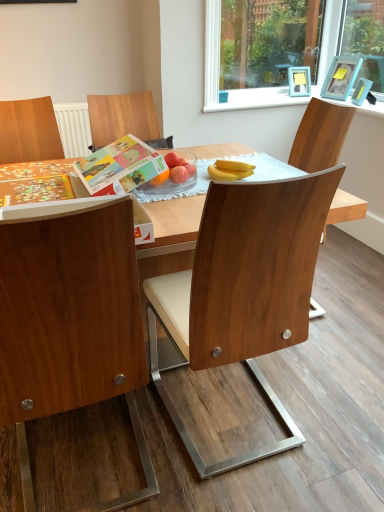
Where is `wooden chair at left, marked as the first chair in a left-to-right arrangement`? wooden chair at left, marked as the first chair in a left-to-right arrangement is located at coordinates (71, 325).

I want to click on matte paper book at center, so click(x=119, y=167).

The image size is (384, 512). What are the coordinates of `white plastic window frame at upper right` in the screenshot? It's located at (220, 73).

Describe the element at coordinates (341, 77) in the screenshot. This screenshot has height=512, width=384. I see `blue plastic picture frame at upper right, which is the 1th picture frame from top to bottom` at that location.

Identify the location of blue plastic picture frame at upper right, arranged as the first picture frame when ordered from the bottom. (361, 91).

This screenshot has width=384, height=512. I want to click on wooden chair at left, marked as the first chair in a left-to-right arrangement, so click(x=71, y=325).

From the image's perspective, which one is positioned higher, wooden chair at left, placed as the 2th chair when sorted from right to left, or wooden chair at center, the 2th chair when ordered from left to right?

wooden chair at center, the 2th chair when ordered from left to right, appears higher in the image.

Is wooden chair at left, placed as the 2th chair when sorted from right to left, not close to wooden chair at center, the 1th chair positioned from the right?

No, wooden chair at left, placed as the 2th chair when sorted from right to left, is in close proximity to wooden chair at center, the 1th chair positioned from the right.

Between wooden chair at left, marked as the first chair in a left-to-right arrangement, and wooden chair at center, the 1th chair positioned from the right, which one has larger width?

wooden chair at left, marked as the first chair in a left-to-right arrangement, is wider.

Is wooden chair at left, placed as the 2th chair when sorted from right to left, at the left side of wooden chair at center, the 2th chair when ordered from left to right?

Correct, you'll find wooden chair at left, placed as the 2th chair when sorted from right to left, to the left of wooden chair at center, the 2th chair when ordered from left to right.

Locate an element on the screen. This screenshot has height=512, width=384. book lying above the wooden chair at left, marked as the first chair in a left-to-right arrangement (from the image's perspective) is located at coordinates (119, 167).

Does wooden chair at left, placed as the 2th chair when sorted from right to left, have a larger size compared to matte paper book at center?

Yes.

Who is taller, wooden chair at left, placed as the 2th chair when sorted from right to left, or matte paper book at center?

wooden chair at left, placed as the 2th chair when sorted from right to left.

From the image's perspective, is wooden chair at left, placed as the 2th chair when sorted from right to left, above matte paper book at center?

No, from the image's perspective, wooden chair at left, placed as the 2th chair when sorted from right to left, is not above matte paper book at center.

From a real-world perspective, is yellow matte bananas at center positioned above or below white plastic window frame at upper right?

yellow matte bananas at center is below white plastic window frame at upper right.

Is yellow matte bananas at center positioned far away from white plastic window frame at upper right?

Yes, yellow matte bananas at center and white plastic window frame at upper right are quite far apart.

Which object is closer to the camera, yellow matte bananas at center or white plastic window frame at upper right?

Positioned in front is yellow matte bananas at center.

Is yellow matte bananas at center wider than white plastic window frame at upper right?

Yes.

Would you say yellow matte bananas at center is a long distance from blue plastic picture frame at upper right, the second picture frame positioned from the top?

yellow matte bananas at center is far away from blue plastic picture frame at upper right, the second picture frame positioned from the top.

Which object is further away from the camera, yellow matte bananas at center or blue plastic picture frame at upper right, arranged as the first picture frame when ordered from the bottom?

blue plastic picture frame at upper right, arranged as the first picture frame when ordered from the bottom, is more distant.

Locate an element on the screen. banana on the left side of blue plastic picture frame at upper right, the second picture frame positioned from the top is located at coordinates (230, 170).

The image size is (384, 512). Find the location of `banana on the right of wooden chair at left, placed as the 2th chair when sorted from right to left`. banana on the right of wooden chair at left, placed as the 2th chair when sorted from right to left is located at coordinates (230, 170).

Looking at this image, is yellow matte bananas at center oriented towards wooden chair at left, marked as the first chair in a left-to-right arrangement?

No, yellow matte bananas at center is not oriented towards wooden chair at left, marked as the first chair in a left-to-right arrangement.

Is yellow matte bananas at center to the left of wooden chair at left, marked as the first chair in a left-to-right arrangement, from the viewer's perspective?

No, yellow matte bananas at center is not to the left of wooden chair at left, marked as the first chair in a left-to-right arrangement.

What's the angular difference between yellow matte bananas at center and wooden chair at left, marked as the first chair in a left-to-right arrangement,'s facing directions?

There is a 59.9-degree angle between the facing directions of yellow matte bananas at center and wooden chair at left, marked as the first chair in a left-to-right arrangement.

What's the angular difference between matte paper book at center and yellow matte bananas at center's facing directions?

27 degrees separate the facing orientations of matte paper book at center and yellow matte bananas at center.

Would you say matte paper book at center is to the left or to the right of yellow matte bananas at center in the picture?

From the image, it's evident that matte paper book at center is to the left of yellow matte bananas at center.

Based on the photo, which is farther, (160,166) or (245,173)?

The point (160,166) is more distant.

Find the location of `book that is above the yellow matte bananas at center (from a real-world perspective)`. book that is above the yellow matte bananas at center (from a real-world perspective) is located at coordinates (119, 167).

From the image's perspective, is white plastic window frame at upper right over yellow matte bananas at center?

Yes, from the image's perspective, white plastic window frame at upper right is on top of yellow matte bananas at center.

You are a GUI agent. You are given a task and a screenshot of the screen. Output one action in this format:
    pyautogui.click(x=<x>, y=<y>)
    Task: Click on the window frame above the yellow matte bananas at center (from a real-world perspective)
    This screenshot has width=384, height=512.
    Given the screenshot: What is the action you would take?
    pyautogui.click(x=220, y=73)

Between point (327, 42) and point (238, 162), which one is positioned in front?

Point (238, 162)

Considering the relative sizes of white plastic window frame at upper right and yellow matte bananas at center in the image provided, is white plastic window frame at upper right taller than yellow matte bananas at center?

Indeed, white plastic window frame at upper right has a greater height compared to yellow matte bananas at center.

Find the location of a particular element. The width and height of the screenshot is (384, 512). chair below the wooden chair at center, the 1th chair positioned from the right (from the image's perspective) is located at coordinates (71, 325).

Identify the location of book that appears above the wooden chair at left, placed as the 2th chair when sorted from right to left (from a real-world perspective). The width and height of the screenshot is (384, 512). (119, 167).

From the image, which object appears to be farther from wooden chair at center, the 1th chair positioned from the right, blue plastic picture frame at upper right, the second picture frame in the bottom-to-top sequence, or white plastic window frame at upper right?

blue plastic picture frame at upper right, the second picture frame in the bottom-to-top sequence, lies further to wooden chair at center, the 1th chair positioned from the right, than the other object.

When comparing their distances from wooden chair at center, the 2th chair when ordered from left to right, does blue plastic picture frame at upper right, the second picture frame positioned from the top, or yellow matte bananas at center seem closer?

yellow matte bananas at center is closer to wooden chair at center, the 2th chair when ordered from left to right.

Looking at the image, which one is located closer to wooden chair at left, placed as the 2th chair when sorted from right to left, yellow matte bananas at center or matte paper book at center?

Based on the image, matte paper book at center appears to be nearer to wooden chair at left, placed as the 2th chair when sorted from right to left.

Based on their spatial positions, is blue plastic picture frame at upper right, arranged as the first picture frame when ordered from the bottom, or white plastic window frame at upper right closer to blue plastic picture frame at upper right, the second picture frame in the bottom-to-top sequence?

blue plastic picture frame at upper right, arranged as the first picture frame when ordered from the bottom, is positioned closer to the anchor blue plastic picture frame at upper right, the second picture frame in the bottom-to-top sequence.

When comparing their distances from yellow matte bananas at center, does matte paper book at center or blue plastic picture frame at upper right, arranged as the first picture frame when ordered from the bottom, seem further?

blue plastic picture frame at upper right, arranged as the first picture frame when ordered from the bottom, lies further to yellow matte bananas at center than the other object.

Based on their spatial positions, is blue plastic picture frame at upper right, arranged as the first picture frame when ordered from the bottom, or wooden chair at center, the 1th chair positioned from the right, further from yellow matte bananas at center?

blue plastic picture frame at upper right, arranged as the first picture frame when ordered from the bottom, lies further to yellow matte bananas at center than the other object.

Estimate the real-world distances between objects in this image. Which object is further from wooden chair at left, placed as the 2th chair when sorted from right to left, yellow matte bananas at center or blue plastic picture frame at upper right, the second picture frame in the bottom-to-top sequence?

blue plastic picture frame at upper right, the second picture frame in the bottom-to-top sequence, lies further to wooden chair at left, placed as the 2th chair when sorted from right to left, than the other object.

From the image, which object appears to be nearer to blue plastic picture frame at upper right, arranged as the first picture frame when ordered from the bottom, white plastic window frame at upper right or wooden chair at left, marked as the first chair in a left-to-right arrangement?

Based on the image, white plastic window frame at upper right appears to be nearer to blue plastic picture frame at upper right, arranged as the first picture frame when ordered from the bottom.

Where is `window frame between wooden chair at left, marked as the first chair in a left-to-right arrangement, and blue plastic picture frame at upper right, which is the 1th picture frame from top to bottom, along the z-axis`? The image size is (384, 512). window frame between wooden chair at left, marked as the first chair in a left-to-right arrangement, and blue plastic picture frame at upper right, which is the 1th picture frame from top to bottom, along the z-axis is located at coordinates (220, 73).

Locate an element on the screen. The image size is (384, 512). chair positioned between wooden chair at left, marked as the first chair in a left-to-right arrangement, and white plastic window frame at upper right from near to far is located at coordinates (244, 288).

In order to click on banana between matte paper book at center and white plastic window frame at upper right from front to back in this screenshot , I will do `click(230, 170)`.

Where is `chair positioned between wooden chair at left, placed as the 2th chair when sorted from right to left, and blue plastic picture frame at upper right, which is the 1th picture frame from top to bottom, from near to far`? This screenshot has width=384, height=512. chair positioned between wooden chair at left, placed as the 2th chair when sorted from right to left, and blue plastic picture frame at upper right, which is the 1th picture frame from top to bottom, from near to far is located at coordinates (244, 288).